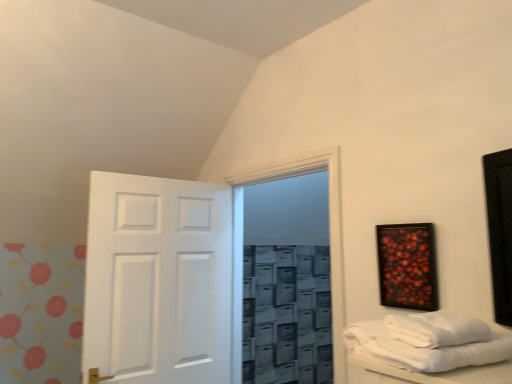
Question: Is transparent glass door at center in front of or behind white cotton towels at right in the image?

Choices:
 (A) front
 (B) behind

Answer: (B)

Question: Considering the positions of transparent glass door at center and white cotton towels at right in the image, is transparent glass door at center wider or thinner than white cotton towels at right?

Choices:
 (A) wide
 (B) thin

Answer: (B)

Question: Based on their relative distances, which object is nearer to the white towel at lower right?

Choices:
 (A) white cotton towels at right
 (B) wooden-framed artwork at upper right
 (C) white matte door at center
 (D) transparent glass door at center

Answer: (A)

Question: Considering the real-world distances, which object is farthest from the white cotton towels at right?

Choices:
 (A) transparent glass door at center
 (B) wooden-framed artwork at upper right
 (C) white matte door at center
 (D) white towel at lower right

Answer: (C)